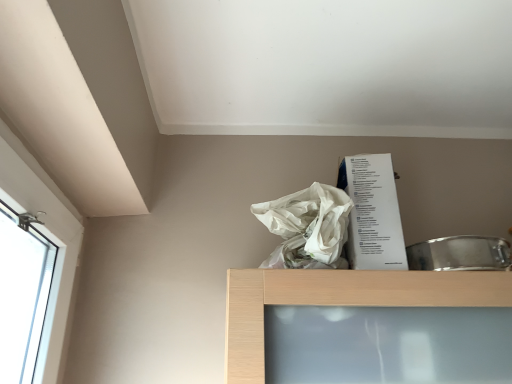
Question: Are white paper at upper center and white plastic bag at upper center beside each other?

Choices:
 (A) no
 (B) yes

Answer: (B)

Question: From the image's perspective, is white paper at upper center located above white plastic bag at upper center?

Choices:
 (A) no
 (B) yes

Answer: (A)

Question: Is white paper at upper center taller than white plastic bag at upper center?

Choices:
 (A) no
 (B) yes

Answer: (B)

Question: From the image's perspective, is white paper at upper center under white plastic bag at upper center?

Choices:
 (A) no
 (B) yes

Answer: (B)

Question: Can you confirm if white paper at upper center is shorter than white plastic bag at upper center?

Choices:
 (A) yes
 (B) no

Answer: (B)

Question: Is the position of white paper at upper center less distant than that of white plastic bag at upper center?

Choices:
 (A) yes
 (B) no

Answer: (B)

Question: Is white plastic bag at upper center with white paper at upper center?

Choices:
 (A) no
 (B) yes

Answer: (B)

Question: Can you confirm if white plastic bag at upper center is bigger than white paper at upper center?

Choices:
 (A) no
 (B) yes

Answer: (A)

Question: Does white plastic bag at upper center have a lesser width compared to white paper at upper center?

Choices:
 (A) no
 (B) yes

Answer: (B)

Question: Are white plastic bag at upper center and white paper at upper center located far from each other?

Choices:
 (A) no
 (B) yes

Answer: (A)

Question: Is white plastic bag at upper center facing away from white paper at upper center?

Choices:
 (A) yes
 (B) no

Answer: (B)

Question: Is white plastic bag at upper center wider than white paper at upper center?

Choices:
 (A) yes
 (B) no

Answer: (B)

Question: Would you say white plastic bag at upper center is to the left or to the right of white paper at upper center in the picture?

Choices:
 (A) left
 (B) right

Answer: (A)